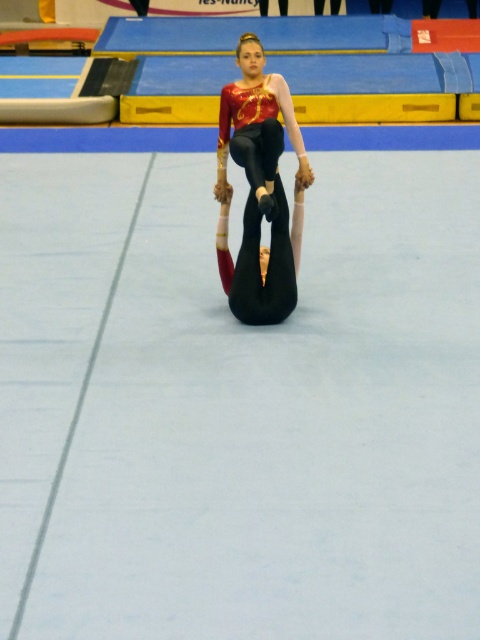
Question: Which point appears closest to the camera in this image?

Choices:
 (A) (283, 92)
 (B) (256, 248)

Answer: (B)

Question: Can you confirm if shiny red leotard at center is positioned above black matte gymnast at center?

Choices:
 (A) no
 (B) yes

Answer: (B)

Question: Is shiny red leotard at center smaller than black matte gymnast at center?

Choices:
 (A) yes
 (B) no

Answer: (B)

Question: Observing the image, what is the correct spatial positioning of shiny red leotard at center in reference to black matte gymnast at center?

Choices:
 (A) above
 (B) below

Answer: (A)

Question: Among these objects, which one is farthest from the camera?

Choices:
 (A) black matte gymnast at center
 (B) shiny red leotard at center

Answer: (A)